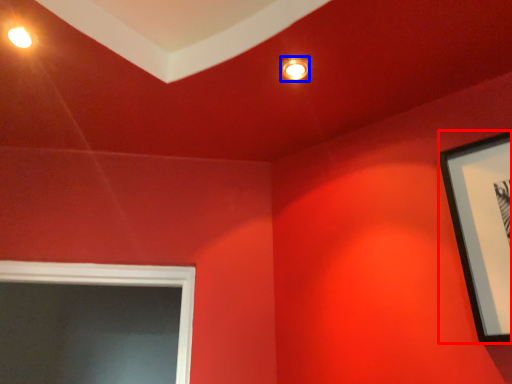
Question: Which of the following is the farthest to the observer, picture frame (highlighted by a red box) or lighting (highlighted by a blue box)?

Choices:
 (A) picture frame
 (B) lighting

Answer: (B)